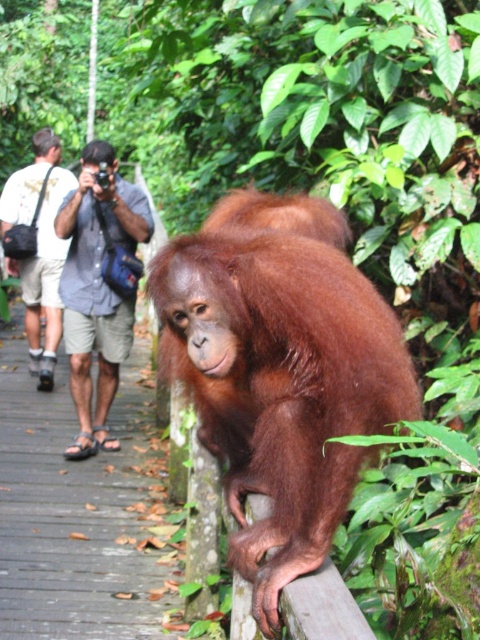
Does orange fur orangutan at center appear on the right side of blue denim shirt at upper left?

Correct, you'll find orange fur orangutan at center to the right of blue denim shirt at upper left.

What do you see at coordinates (279, 371) in the screenshot? Image resolution: width=480 pixels, height=640 pixels. I see `orange fur orangutan at center` at bounding box center [279, 371].

Is point (213, 268) less distant than point (73, 376)?

Yes.

At what (x,y) coordinates should I click in order to perform the action: click on orange fur orangutan at center. Please return your answer as a coordinate pair (x, y). This screenshot has width=480, height=640. Looking at the image, I should click on (279, 371).

Can you confirm if orange fur orangutan at center is thinner than white t-shirt at left?

No, orange fur orangutan at center is not thinner than white t-shirt at left.

The height and width of the screenshot is (640, 480). What do you see at coordinates (279, 371) in the screenshot?
I see `orange fur orangutan at center` at bounding box center [279, 371].

I want to click on orange fur orangutan at center, so click(x=279, y=371).

Can you confirm if blue denim shirt at upper left is positioned above white t-shirt at left?

Incorrect, blue denim shirt at upper left is not positioned above white t-shirt at left.

Can you confirm if blue denim shirt at upper left is positioned to the left of white t-shirt at left?

Incorrect, blue denim shirt at upper left is not on the left side of white t-shirt at left.

Who is more forward, (109, 340) or (47, 168)?

Point (109, 340)

The width and height of the screenshot is (480, 640). I want to click on blue denim shirt at upper left, so click(99, 285).